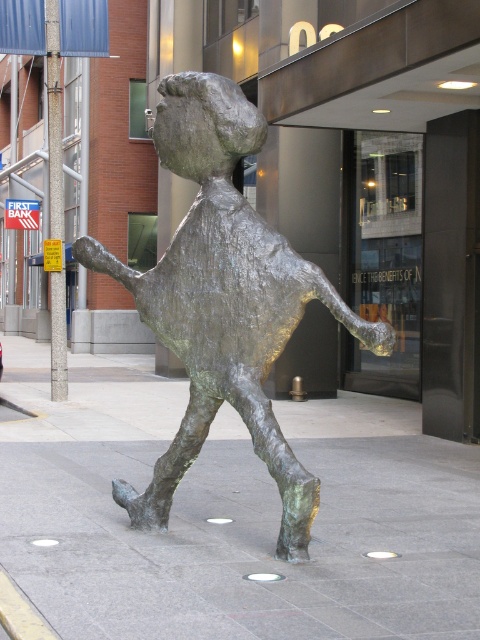
Is point (448, 449) in front of point (241, 224)?

That is False.

Between green patina pavement at center and bronze statue at center, which one is positioned lower?

green patina pavement at center is lower down.

The height and width of the screenshot is (640, 480). Identify the location of green patina pavement at center. (230, 513).